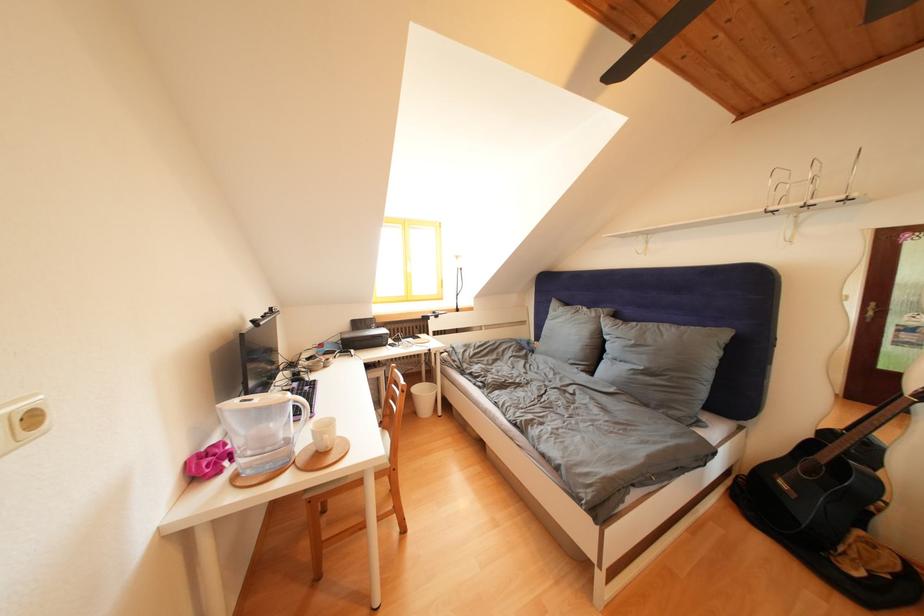
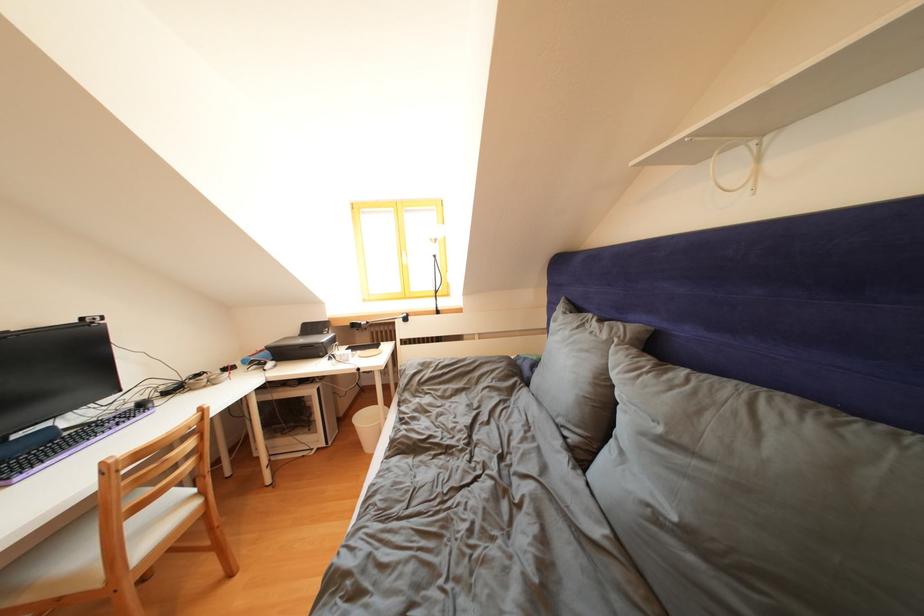
Where in the second image is the point corresponding to [640,347] from the first image?

(667, 435)